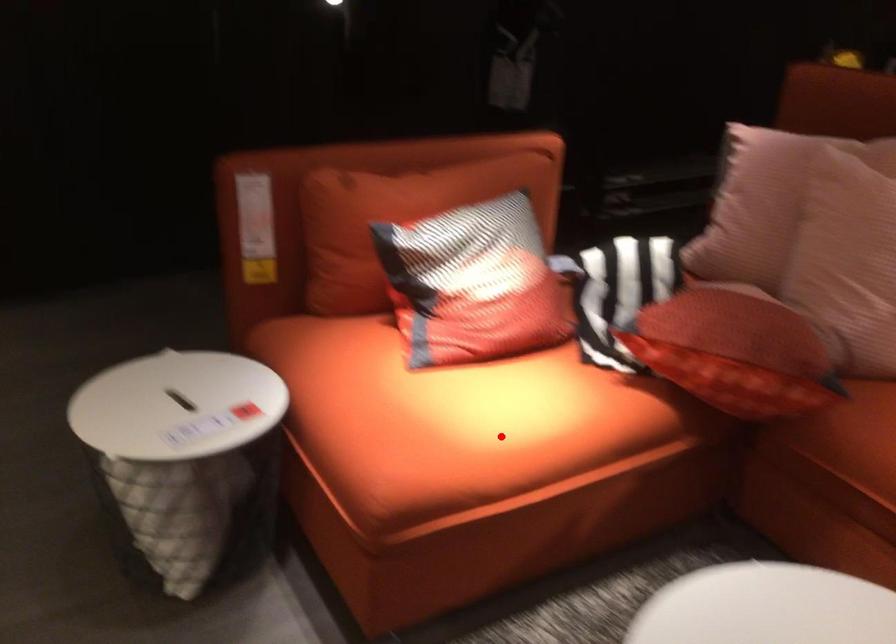
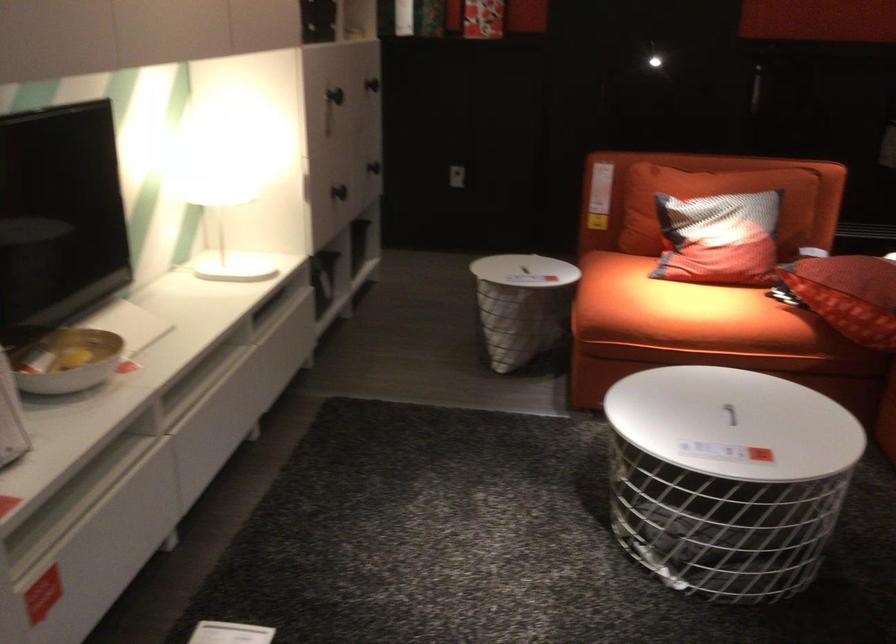
Locate, in the second image, the point that corresponds to the highlighted location in the first image.

(684, 312)